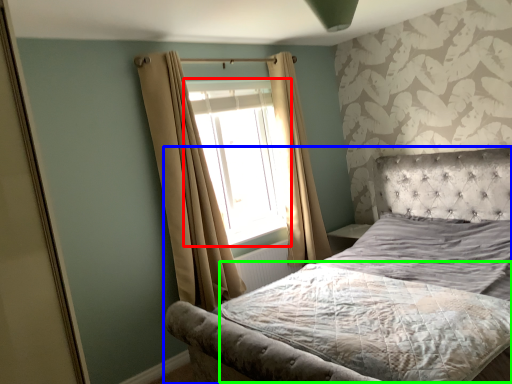
Question: Which is nearer to the window (highlighted by a red box)? bed (highlighted by a blue box) or mattress (highlighted by a green box).

Choices:
 (A) bed
 (B) mattress

Answer: (A)